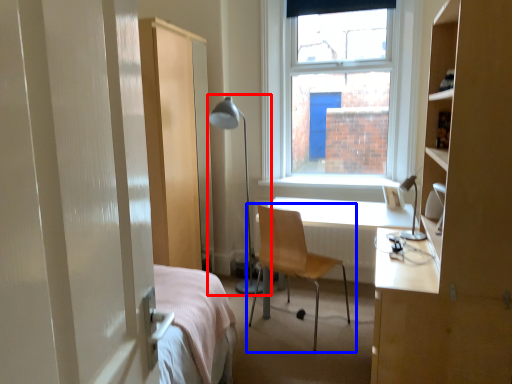
Question: Which of the following is the closest to the observer, table lamp (highlighted by a red box) or chair (highlighted by a blue box)?

Choices:
 (A) table lamp
 (B) chair

Answer: (B)